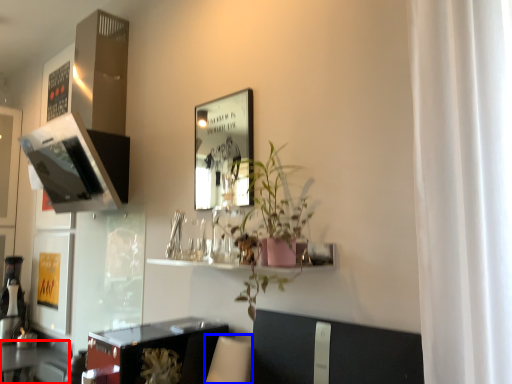
Question: Which object appears farthest to the camera in this image, table (highlighted by a red box) or swivel chair (highlighted by a blue box)?

Choices:
 (A) table
 (B) swivel chair

Answer: (A)